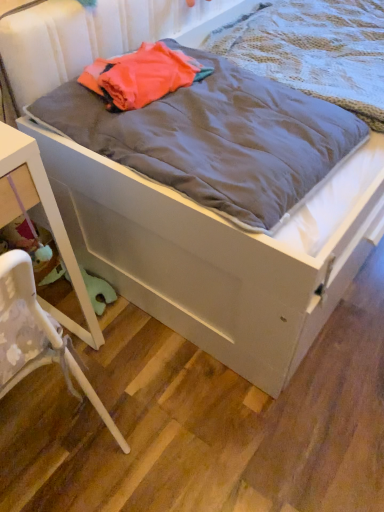
Find the location of a particular element. Image resolution: width=384 pixels, height=512 pixels. spots to the right of white plastic chair at lower left is located at coordinates (165, 416).